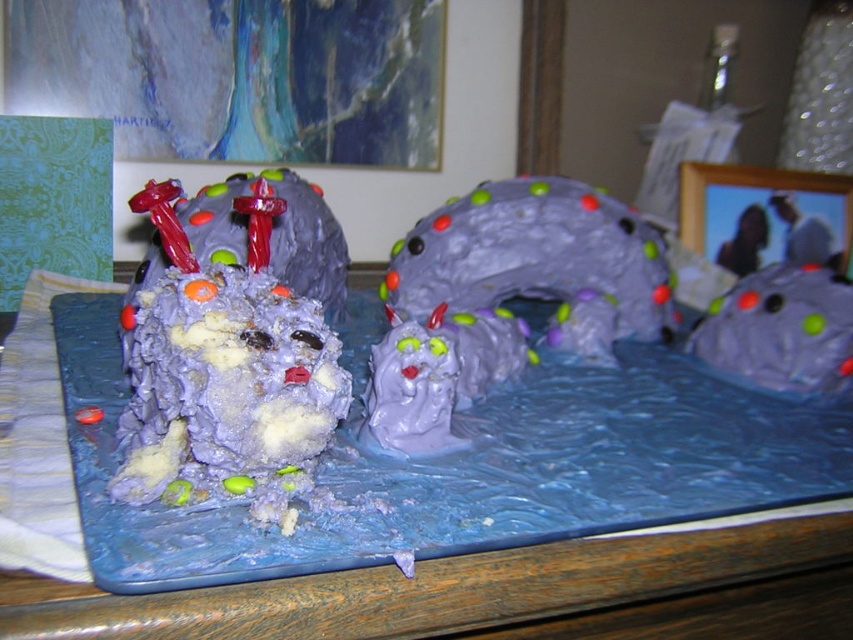
You are a guest at a birthday party where this cake is displayed. You want to take a photo of the blue fondant cake at center and the purple frosted cake at left. To ensure both are in the frame, should you position yourself to the left or right side of the cake arrangement?

You should position yourself to the right side of the cake arrangement. Since the blue fondant cake at center is to the left of the purple frosted cake at left, placing yourself to the right would allow both cakes to be captured in the photo frame.

You are a baker trying to place both the blue fondant cake at center and the purple frosted cake at left on a 20 cm wide display shelf. Can both cakes fit side by side without overlapping?

The blue fondant cake at center is wider than the purple frosted cake at left. Since the total width of both cakes combined would exceed 20 cm, they cannot fit side by side on the display shelf without overlapping.

You are a cake decorator who wants to place a star decoration on the point at coordinate point (419, 563). Based on the scene description, where exactly will this star decoration be placed?

The star decoration will be placed on the blue fondant cake at center, as the point (419, 563) is on blue fondant cake at center.